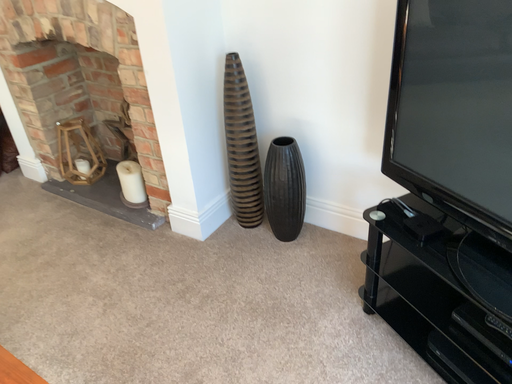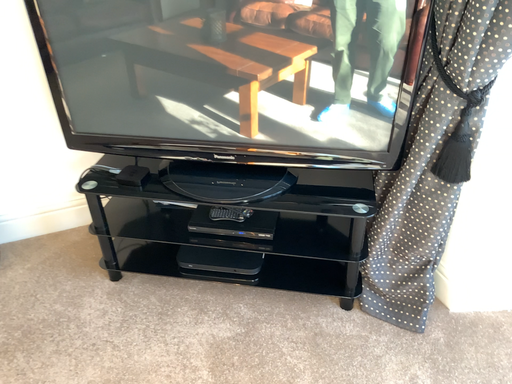
Question: How did the camera likely rotate when shooting the video?

Choices:
 (A) rotated left
 (B) rotated right

Answer: (B)